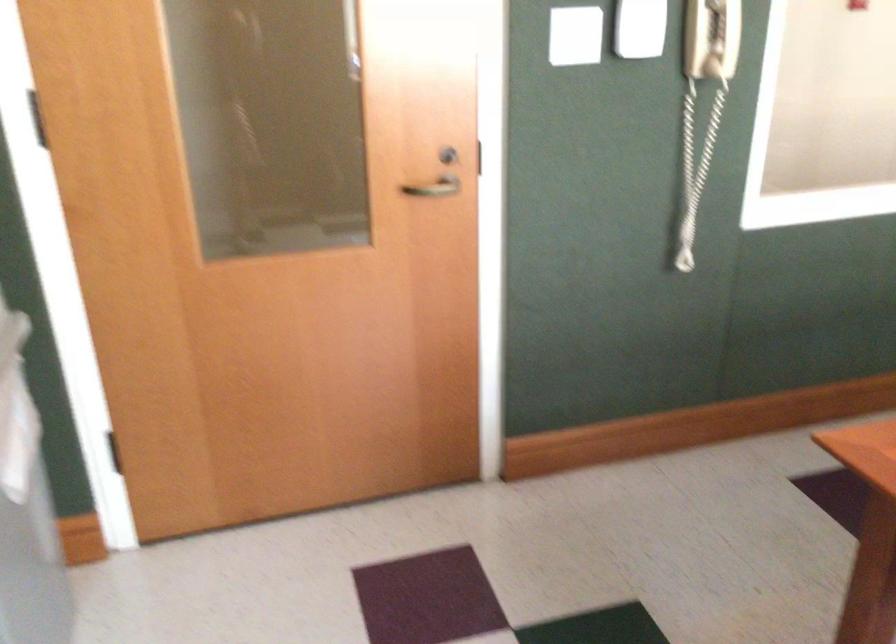
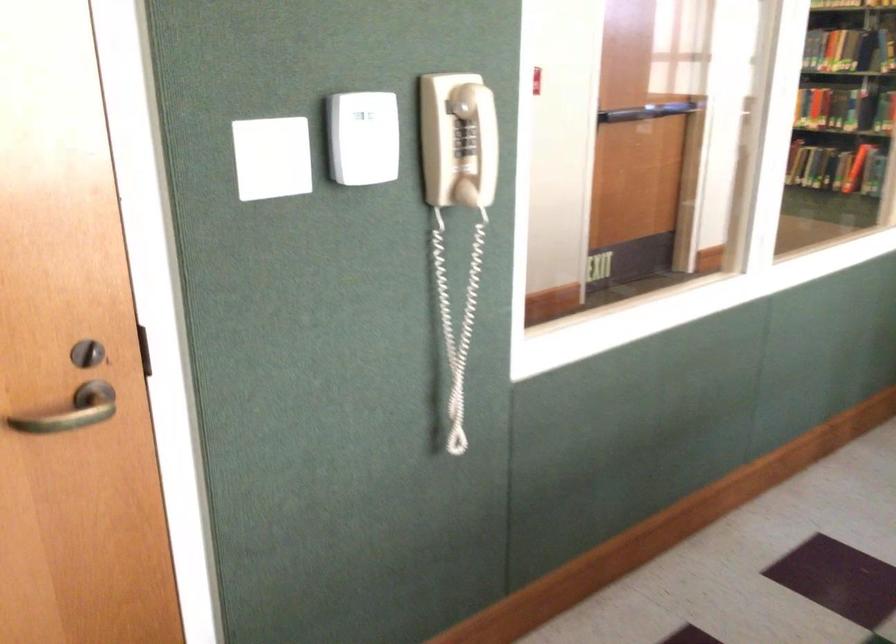
Question: Based on the continuous images, in which direction is the camera rotating? Reply with the corresponding letter.

Choices:
 (A) Left
 (B) Right
 (C) Up
 (D) Down

Answer: (B)